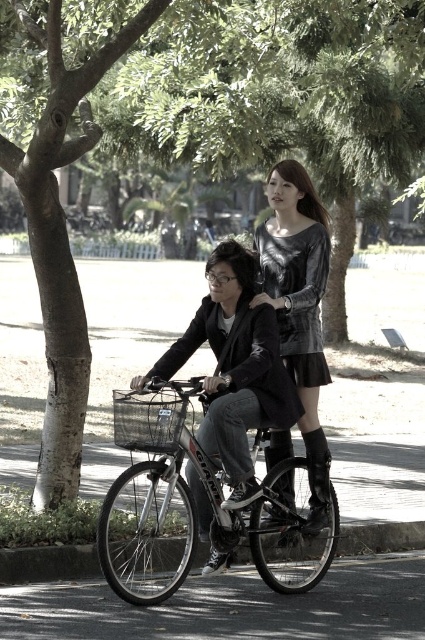
You are a cyclist planning to attach a new basket to your silver metallic bicycle at center. According to the scene, where is the existing black wire basket at center located relative to your bicycle?

The silver metallic bicycle at center is in front of the black wire basket at center, meaning the existing basket is behind the bicycle.